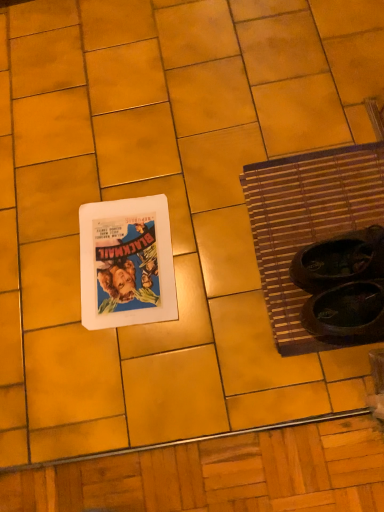
Question: From the image's perspective, is white matte picture frame at center-left located above brown woven mat at right?

Choices:
 (A) no
 (B) yes

Answer: (A)

Question: Considering the relative sizes of white matte picture frame at center-left and brown woven mat at right in the image provided, is white matte picture frame at center-left smaller than brown woven mat at right?

Choices:
 (A) no
 (B) yes

Answer: (B)

Question: Considering the relative sizes of white matte picture frame at center-left and brown woven mat at right in the image provided, is white matte picture frame at center-left bigger than brown woven mat at right?

Choices:
 (A) no
 (B) yes

Answer: (A)

Question: Is white matte picture frame at center-left located outside brown woven mat at right?

Choices:
 (A) yes
 (B) no

Answer: (A)

Question: Does white matte picture frame at center-left have a lesser width compared to brown woven mat at right?

Choices:
 (A) yes
 (B) no

Answer: (A)

Question: Is white matte picture frame at center-left at the right side of brown woven mat at right?

Choices:
 (A) yes
 (B) no

Answer: (B)

Question: Can you confirm if brown woven mat at right is taller than white matte picture frame at center-left?

Choices:
 (A) yes
 (B) no

Answer: (A)

Question: Can you confirm if brown woven mat at right is smaller than white matte picture frame at center-left?

Choices:
 (A) yes
 (B) no

Answer: (B)

Question: Is brown woven mat at right further to the viewer compared to white matte picture frame at center-left?

Choices:
 (A) no
 (B) yes

Answer: (A)

Question: From a real-world perspective, is brown woven mat at right over white matte picture frame at center-left?

Choices:
 (A) no
 (B) yes

Answer: (A)

Question: Is brown woven mat at right bigger than white matte picture frame at center-left?

Choices:
 (A) no
 (B) yes

Answer: (B)

Question: From the image's perspective, is brown woven mat at right beneath white matte picture frame at center-left?

Choices:
 (A) yes
 (B) no

Answer: (B)

Question: Does point (362, 158) appear closer or farther from the camera than point (150, 197)?

Choices:
 (A) farther
 (B) closer

Answer: (B)